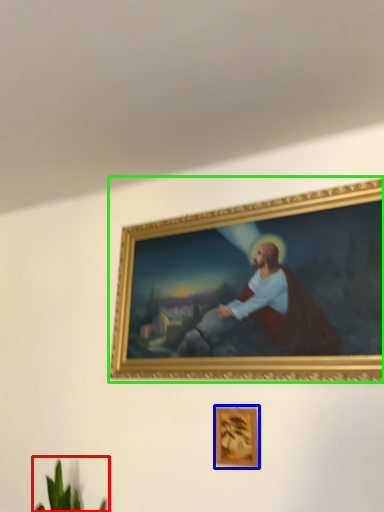
Question: Which object is positioned farthest from plant (highlighted by a red box)? Select from picture frame (highlighted by a blue box) and picture frame (highlighted by a green box).

Choices:
 (A) picture frame
 (B) picture frame

Answer: (B)